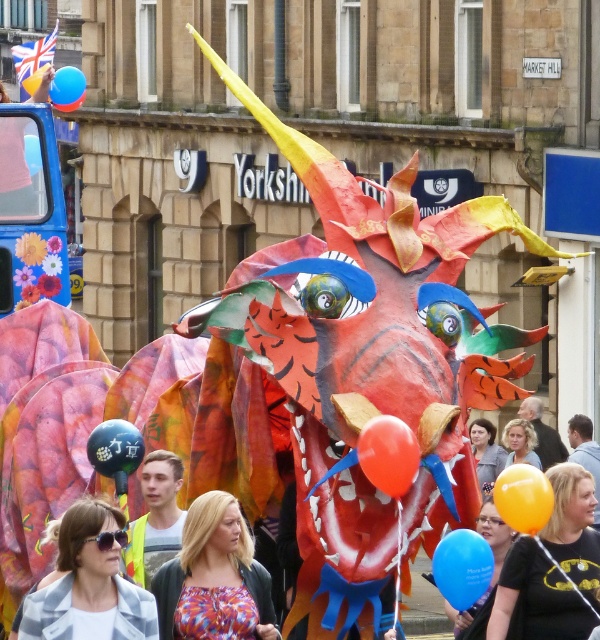
Does multicolored fabric at center appear over matte black balloon at center?

Incorrect, multicolored fabric at center is not positioned above matte black balloon at center.

Is multicolored fabric at center smaller than matte black balloon at center?

Actually, multicolored fabric at center might be larger than matte black balloon at center.

This screenshot has height=640, width=600. What do you see at coordinates (214, 577) in the screenshot? I see `multicolored fabric at center` at bounding box center [214, 577].

Identify the location of multicolored fabric at center. Image resolution: width=600 pixels, height=640 pixels. (214, 577).

Who is taller, matte blue balloon at lower center or blue glossy balloon at upper left?

matte blue balloon at lower center is taller.

Find the location of `matte blue balloon at lower center`. matte blue balloon at lower center is located at coordinates (493, 556).

Between batman t-shirt at lower right and blue glossy balloon at upper left, which one is positioned lower?

Positioned lower is batman t-shirt at lower right.

Does batman t-shirt at lower right have a greater width compared to blue glossy balloon at upper left?

Indeed, batman t-shirt at lower right has a greater width compared to blue glossy balloon at upper left.

Between point (552, 636) and point (37, 156), which one is positioned in front?

Point (552, 636)

I want to click on batman t-shirt at lower right, so click(538, 596).